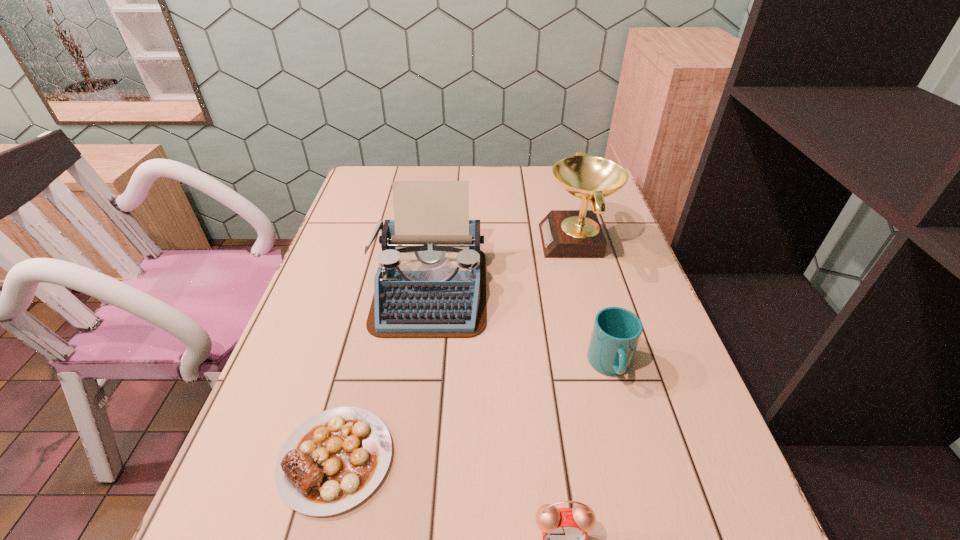
Locate an element on the screen. award is located at coordinates (564, 233).

You are a GUI agent. You are given a task and a screenshot of the screen. Output one action in this format:
    pyautogui.click(x=<x>, y=<y>)
    Task: Click on the typewriter
    The width and height of the screenshot is (960, 540).
    Given the screenshot: What is the action you would take?
    pyautogui.click(x=431, y=281)

Find the location of `the third nearest object`. the third nearest object is located at coordinates (616, 332).

Where is `steak`? This screenshot has height=540, width=960. steak is located at coordinates (334, 460).

What are the coordinates of `the shortest object` in the screenshot? It's located at (334, 460).

Identify the location of free location located 0.070m on the front-facing side of the award. (516, 241).

Find the location of a particular element. This screenshot has width=960, height=540. vacant area located on the front-facing side of the award is located at coordinates (520, 241).

In order to click on vacant space situated on the front-facing side of the award in this screenshot , I will do `click(432, 241)`.

At what (x,y) coordinates should I click in order to perform the action: click on free location located on the typing side of the typewriter. Please return your answer as a coordinate pair (x, y). Looking at the image, I should click on (418, 379).

Where is `vacant point located on the handle side of the cup`? vacant point located on the handle side of the cup is located at coordinates (641, 481).